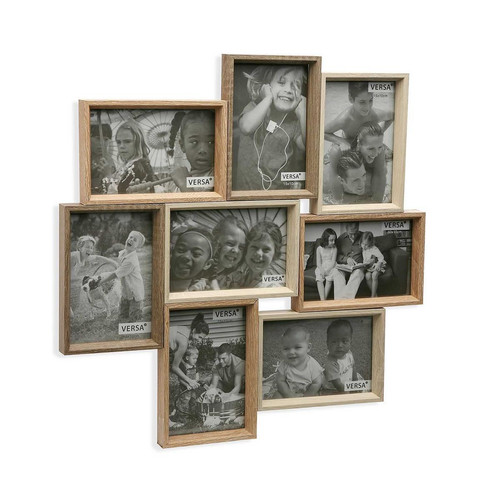
This screenshot has height=500, width=500. Find the location of `picture frame that is horizontal`. picture frame that is horizontal is located at coordinates (334, 352), (210, 244), (337, 269), (172, 138).